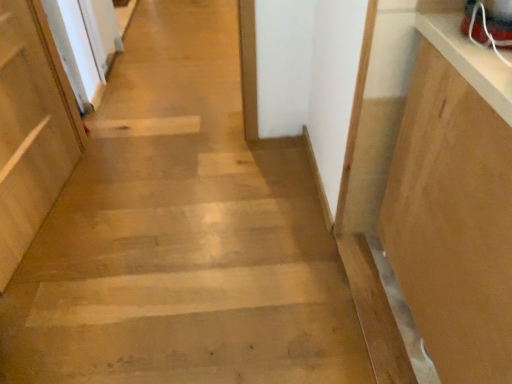
Question: Is matte wood door at left wider or thinner than light brown wood cabinet at right?

Choices:
 (A) wide
 (B) thin

Answer: (B)

Question: From a real-world perspective, relative to light brown wood cabinet at right, is matte wood door at left vertically above or below?

Choices:
 (A) above
 (B) below

Answer: (B)

Question: Does point (34, 33) appear closer or farther from the camera than point (448, 87)?

Choices:
 (A) closer
 (B) farther

Answer: (B)

Question: Would you say light brown wood cabinet at right is inside or outside matte wood door at left?

Choices:
 (A) outside
 (B) inside

Answer: (A)

Question: Considering the positions of light brown wood cabinet at right and matte wood door at left in the image, is light brown wood cabinet at right wider or thinner than matte wood door at left?

Choices:
 (A) thin
 (B) wide

Answer: (B)

Question: In terms of height, does light brown wood cabinet at right look taller or shorter compared to matte wood door at left?

Choices:
 (A) short
 (B) tall

Answer: (B)

Question: Considering the relative positions of light brown wood cabinet at right and matte wood door at left in the image provided, is light brown wood cabinet at right to the left or to the right of matte wood door at left?

Choices:
 (A) right
 (B) left

Answer: (A)